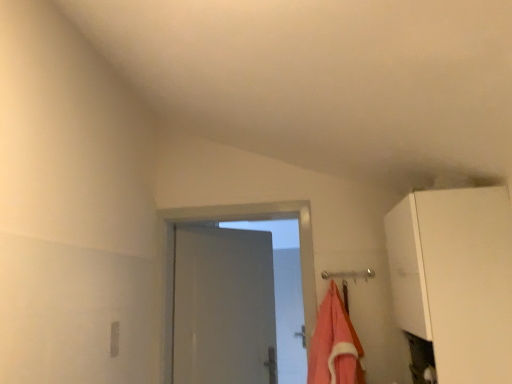
Question: Considering the relative positions of orange cotton towel at center and white matte cabinet at upper right in the image provided, is orange cotton towel at center behind white matte cabinet at upper right?

Choices:
 (A) yes
 (B) no

Answer: (A)

Question: Are orange cotton towel at center and white matte cabinet at upper right making contact?

Choices:
 (A) yes
 (B) no

Answer: (B)

Question: Considering the relative sizes of orange cotton towel at center and white matte cabinet at upper right in the image provided, is orange cotton towel at center bigger than white matte cabinet at upper right?

Choices:
 (A) no
 (B) yes

Answer: (A)

Question: Can you confirm if orange cotton towel at center is positioned to the right of white matte cabinet at upper right?

Choices:
 (A) no
 (B) yes

Answer: (A)

Question: From a real-world perspective, is orange cotton towel at center below white matte cabinet at upper right?

Choices:
 (A) no
 (B) yes

Answer: (B)

Question: From the image's perspective, would you say orange cotton towel at center is positioned over white matte cabinet at upper right?

Choices:
 (A) yes
 (B) no

Answer: (B)

Question: Considering the relative sizes of white matte cabinet at upper right and orange cotton towel at center in the image provided, is white matte cabinet at upper right bigger than orange cotton towel at center?

Choices:
 (A) yes
 (B) no

Answer: (A)

Question: Is white matte cabinet at upper right looking in the opposite direction of orange cotton towel at center?

Choices:
 (A) yes
 (B) no

Answer: (B)

Question: Is white matte cabinet at upper right outside of orange cotton towel at center?

Choices:
 (A) no
 (B) yes

Answer: (B)

Question: Considering the relative sizes of white matte cabinet at upper right and orange cotton towel at center in the image provided, is white matte cabinet at upper right taller than orange cotton towel at center?

Choices:
 (A) no
 (B) yes

Answer: (B)

Question: Is white matte cabinet at upper right directly adjacent to orange cotton towel at center?

Choices:
 (A) yes
 (B) no

Answer: (B)

Question: Does white matte cabinet at upper right have a lesser width compared to orange cotton towel at center?

Choices:
 (A) no
 (B) yes

Answer: (A)

Question: Is orange cotton towel at center in front of or behind white matte cabinet at upper right in the image?

Choices:
 (A) front
 (B) behind

Answer: (B)